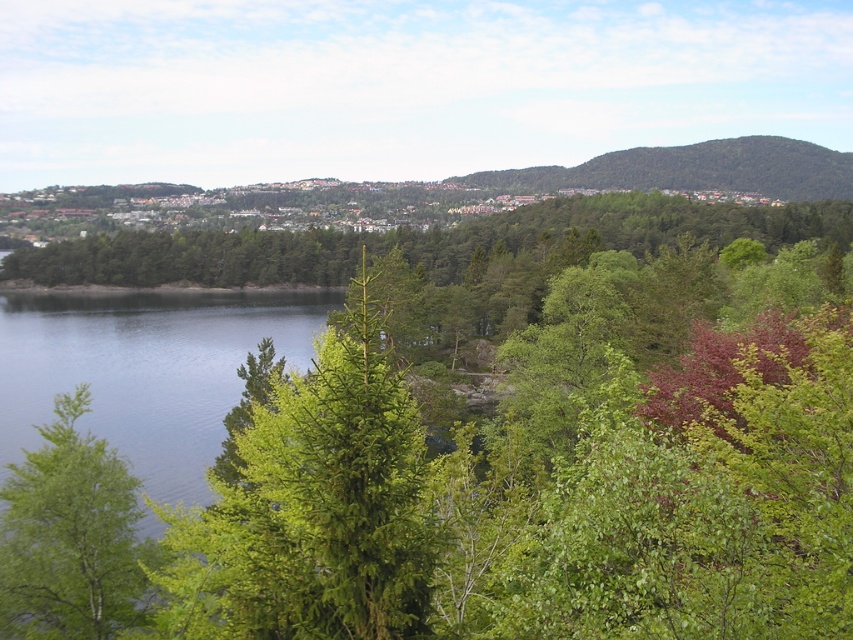
Question: Does blue water at left appear over green leafy tree at lower left?

Choices:
 (A) yes
 (B) no

Answer: (A)

Question: Which of the following is the farthest from the observer?

Choices:
 (A) pos(42,323)
 (B) pos(62,401)
 (C) pos(759,138)

Answer: (C)

Question: Is green leafy tree at center wider than green leafy hillside at upper center?

Choices:
 (A) no
 (B) yes

Answer: (A)

Question: Which object appears closest to the camera in this image?

Choices:
 (A) green leafy tree at lower left
 (B) green leafy hillside at upper center
 (C) blue water at left
 (D) green leafy tree at center

Answer: (D)

Question: Which object is the closest to the green leafy tree at lower left?

Choices:
 (A) green leafy hillside at upper center
 (B) green leafy tree at center

Answer: (B)

Question: Is blue water at left wider than green leafy tree at lower left?

Choices:
 (A) yes
 (B) no

Answer: (A)